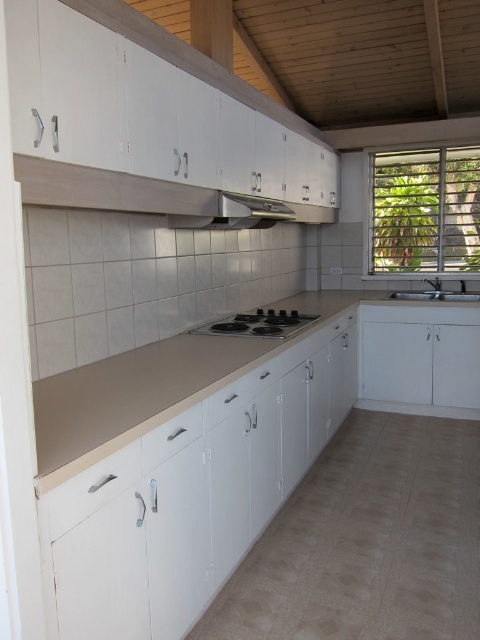
You are a chef preparing to install a new ventilation system in the kitchen. You need to position the ventilation system above the stove to ensure proper airflow. Given the current setup, is the matte black exhaust hood at upper center already positioned correctly above the black glass stove at center?

Yes, the matte black exhaust hood at upper center is already positioned correctly above the black glass stove at center, as it is located above it, ensuring proper airflow for the ventilation system.

You are standing in the kitchen and see a point marked at coordinates (257, 323). According to the scene description, which object is this point located on?

The point at coordinates (257, 323) is located on the black glass stove at center.